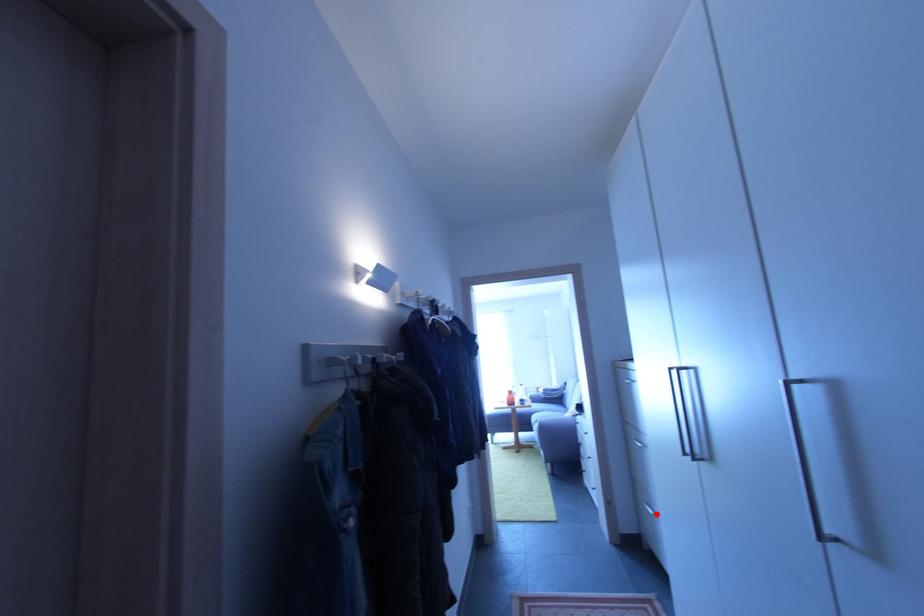
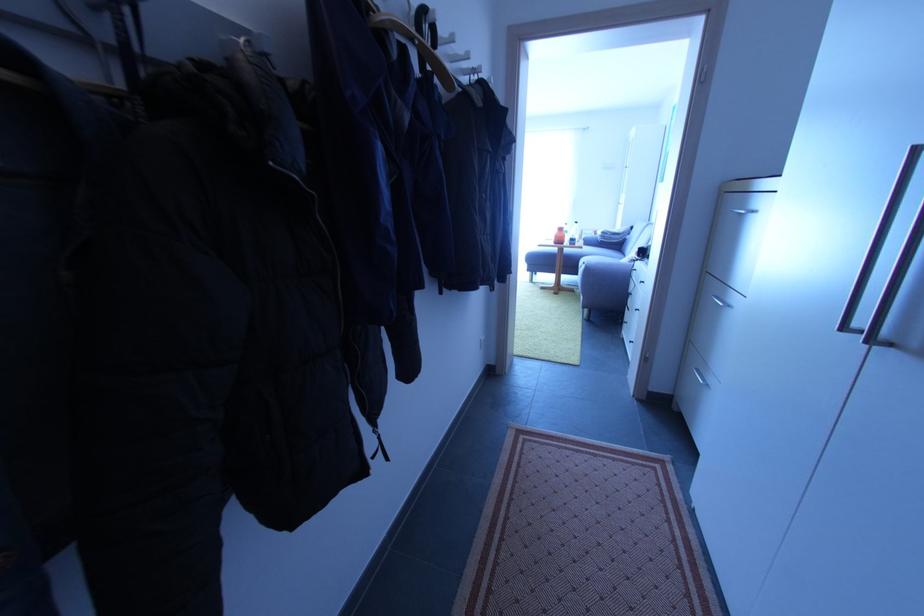
In the second image, find the point that corresponds to the highlighted location in the first image.

(706, 383)